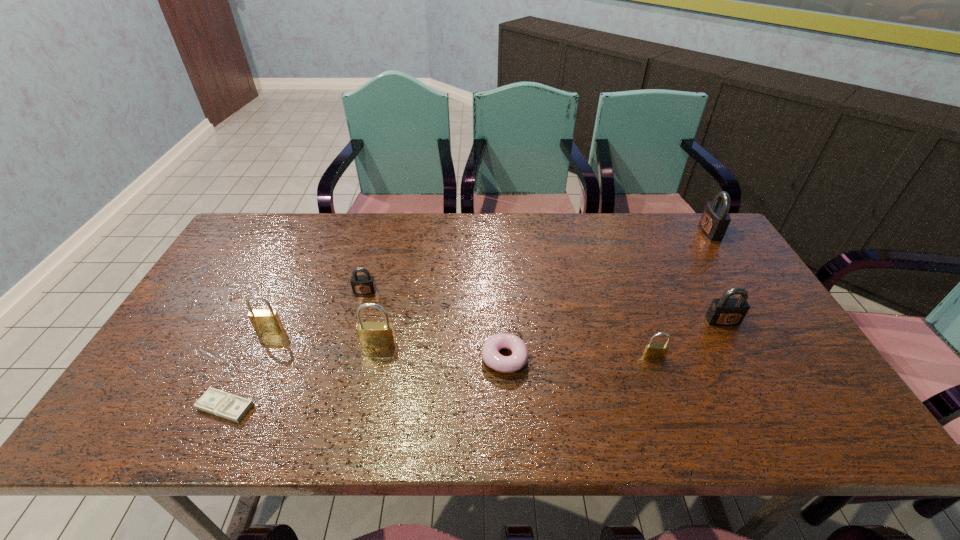
The width and height of the screenshot is (960, 540). I want to click on the third object from right to left, so click(x=653, y=351).

Where is `the rightmost brass padlock`? Image resolution: width=960 pixels, height=540 pixels. the rightmost brass padlock is located at coordinates (653, 351).

This screenshot has width=960, height=540. What are the coordinates of `doughnut` in the screenshot? It's located at (492, 358).

This screenshot has width=960, height=540. Find the location of `the fourth object from right to left`. the fourth object from right to left is located at coordinates (492, 358).

The height and width of the screenshot is (540, 960). I want to click on the shortest object, so click(x=214, y=401).

This screenshot has height=540, width=960. In order to click on money in this screenshot , I will do `click(214, 401)`.

Identify the location of vacant area located on the front of the rightmost gray padlock near the keyhole. (660, 232).

Identify the location of vacant space located on the front of the rightmost gray padlock near the keyhole. The height and width of the screenshot is (540, 960). (678, 232).

This screenshot has height=540, width=960. Find the location of `vacant space located on the front of the rightmost gray padlock near the keyhole`. vacant space located on the front of the rightmost gray padlock near the keyhole is located at coordinates (642, 232).

The height and width of the screenshot is (540, 960). What are the coordinates of `free spot located on the front-facing side of the second brass padlock from left to right` in the screenshot? It's located at (373, 369).